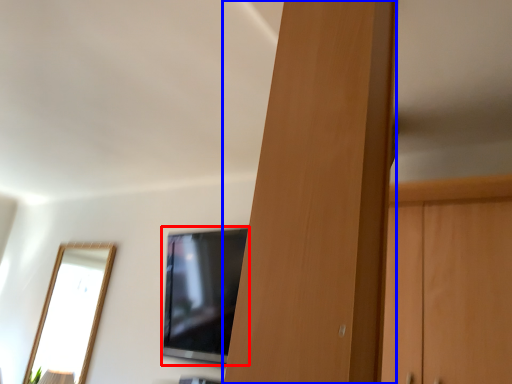
Question: Which point is closer to the camera, television (highlighted by a red box) or door (highlighted by a blue box)?

Choices:
 (A) television
 (B) door

Answer: (B)